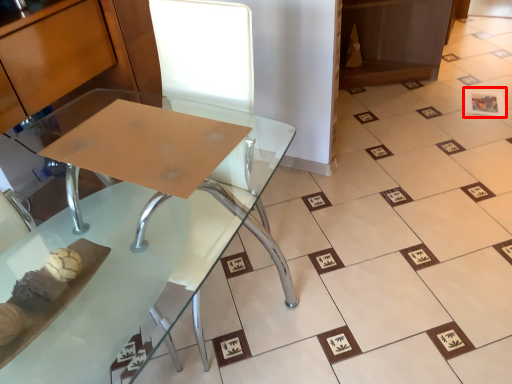
Question: Considering the relative positions of square (annotated by the red box) and table in the image provided, where is square (annotated by the red box) located with respect to the staircase?

Choices:
 (A) right
 (B) left

Answer: (A)